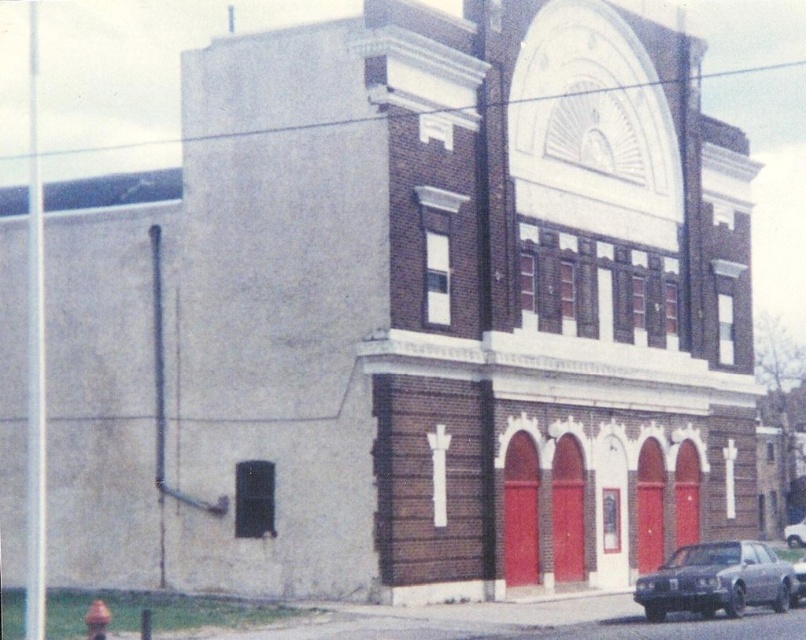
You are a driver arriving at the building and need to park your car. The parking spot is to the right of the green rubber fire hydrant at lower left. Can you park the metallic gray sedan at lower right there?

The metallic gray sedan at lower right is already positioned to the right of the green rubber fire hydrant at lower left, so the parking spot is occupied.

You are a delivery driver approaching the building and need to park your vehicle. The green rubber fire hydrant at lower left is blocking the shiny silver car at lower right. Can you safely move your vehicle around the hydrant to access the car?

The green rubber fire hydrant at lower left is positioned over the shiny silver car at lower right, meaning the hydrant is directly in front of the car. This blocks access, so you cannot safely move your vehicle around the hydrant to reach the car without risking damage or violating parking regulations.

You are a delivery driver approaching the two story building with a metallic gray sedan at lower right parked nearby. To access the main entrance, you need to know if the sedan is blocking the arched openings at ground level. Based on its position at point 0.908, 0.891, is the sedan blocking the entrance?

The metallic gray sedan at lower right is located at point (x=717, y=580). Since the arched openings at ground level are part of the building structure and the sedan is positioned at the lower right corner, it is likely not blocking the main entrance which is centrally located. However, without exact coordinates for the entrance, we can infer based on typical architectural layouts that the sedan is parked away from the central entrance, so it is probably not blocking the entrance.